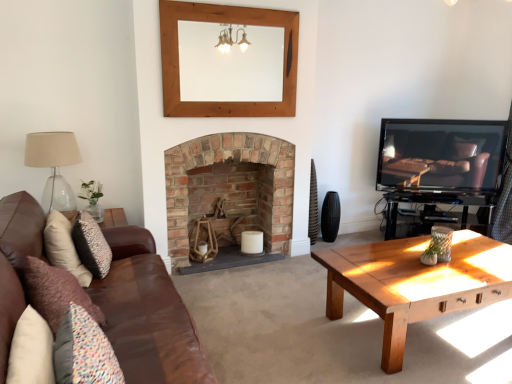
Question: Visually, is black matte speaker at center positioned to the left or to the right of matte black tv at right?

Choices:
 (A) left
 (B) right

Answer: (A)

Question: Based on their sizes in the image, would you say black matte speaker at center is bigger or smaller than matte black tv at right?

Choices:
 (A) small
 (B) big

Answer: (A)

Question: Which object is positioned farthest from the translucent glass lampshade at left?

Choices:
 (A) velvet purple pillow at left, the 2th pillow positioned from the right
 (B) velvet floral pillow at left, placed as the third pillow when sorted from right to left
 (C) wooden mirror at upper center
 (D) rustic brick fireplace at center
 (E) black matte speaker at center

Answer: (E)

Question: Estimate the real-world distances between objects in this image. Which object is farther from the translucent glass lampshade at left?

Choices:
 (A) black matte speaker at center
 (B) wooden mirror at upper center
 (C) brown leather couch at center
 (D) matte black tv at right
 (E) multicolored fabric pillow at lower left, positioned as the 1th pillow in right-to-left order

Answer: (D)